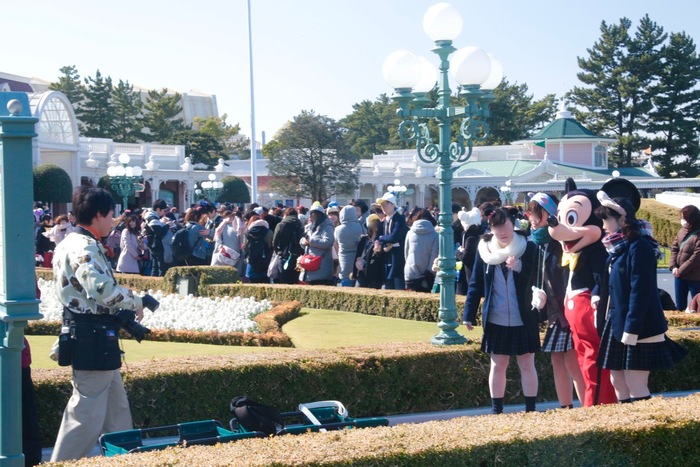
Identify the location of entrance. This screenshot has width=700, height=467. (71, 156).